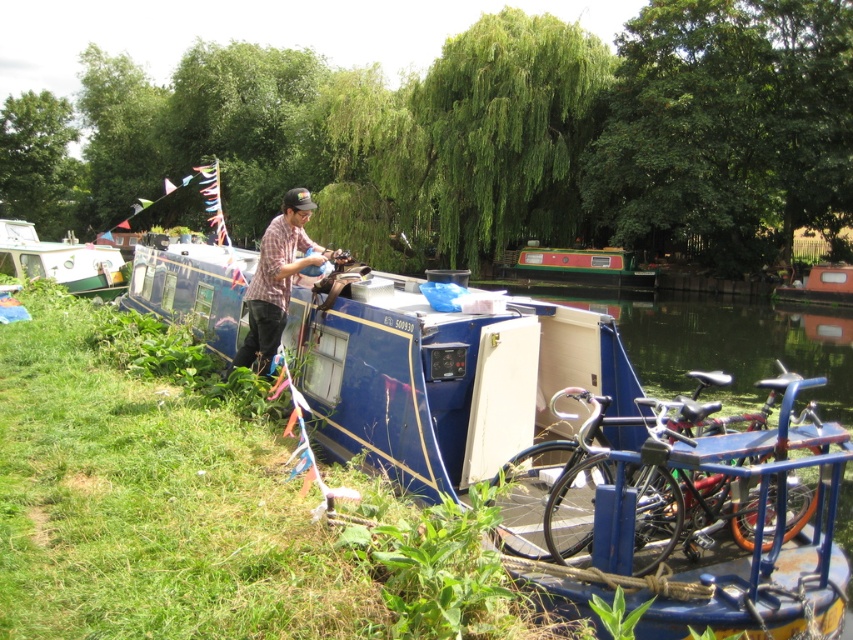
You are planning to ride a bicycle from the shiny metallic bicycles at lower right to the orange matte boat at center. What is the approximate distance you need to cover?

The distance between the shiny metallic bicycles at lower right and the orange matte boat at center is 100.72 feet, so you need to cover approximately 100.72 feet.

You are standing at the position of the man on the deck of the deep blue narrowboat. You see two points in the scene, point (308, 259) and point (790, 289). Which point is closer to you?

Point (308, 259) is closer to the camera than point (790, 289), so the point closer to you is point (308, 259).

You are a delivery person who needs to park your 1.2 meter wide van between the green glossy narrowboat at center and the orange matte boat at center. Can you fit your van between them?

The green glossy narrowboat at center is wider than the orange matte boat at center. However, without knowing the exact distance between them, it is impossible to determine if the van can fit.